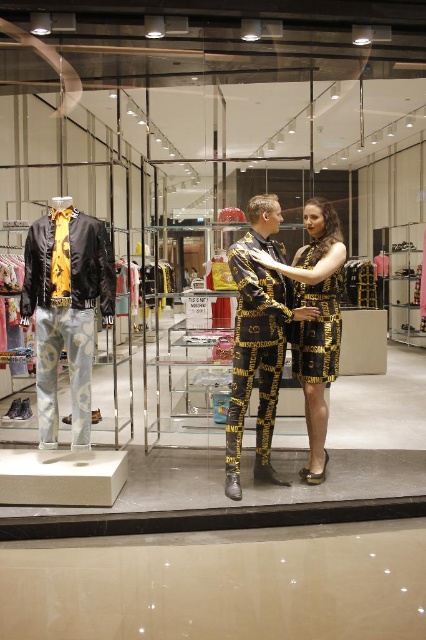
Does gold metallic suit at center have a lesser width compared to gold metallic dress at center?

In fact, gold metallic suit at center might be wider than gold metallic dress at center.

Can you confirm if gold metallic suit at center is smaller than gold metallic dress at center?

Incorrect, gold metallic suit at center is not smaller in size than gold metallic dress at center.

This screenshot has width=426, height=640. What are the coordinates of `gold metallic suit at center` in the screenshot? It's located at (268, 323).

The image size is (426, 640). In order to click on gold metallic suit at center in this screenshot , I will do `click(268, 323)`.

Measure the distance between gold metallic suit at center and matte black jacket at left.

gold metallic suit at center and matte black jacket at left are 1.05 meters apart from each other.

Is point (336, 260) positioned before point (28, 230)?

Yes, point (336, 260) is in front of point (28, 230).

Locate an element on the screen. gold metallic suit at center is located at coordinates (268, 323).

Identify the location of gold metallic suit at center. (268, 323).

Which is above, gold metallic pants at center or gold metallic dress at center?

gold metallic dress at center is higher up.

Does gold metallic pants at center appear over gold metallic dress at center?

No.

Where is `gold metallic pants at center`? The height and width of the screenshot is (640, 426). gold metallic pants at center is located at coordinates (256, 344).